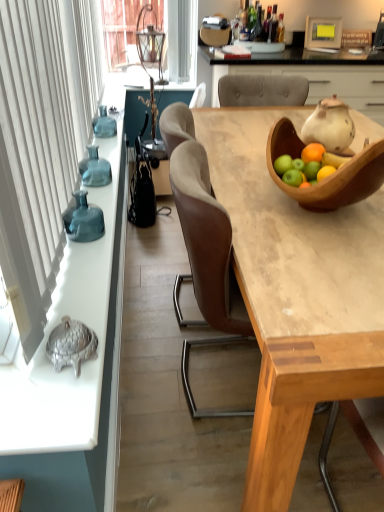
Question: Considering the relative positions of translucent glass vase at left, the 2th vase from the bottom, and wooden bowl at upper right in the image provided, is translucent glass vase at left, the 2th vase from the bottom, to the left or to the right of wooden bowl at upper right?

Choices:
 (A) left
 (B) right

Answer: (A)

Question: Is translucent glass vase at left, which is the 1th vase from top to bottom, situated inside wooden bowl at upper right or outside?

Choices:
 (A) inside
 (B) outside

Answer: (B)

Question: Which object is the closest to the translucent glass vase at left?

Choices:
 (A) teal glass vase at left, which is counted as the second vase, starting from the back
 (B) wooden table at center
 (C) wooden cabinet at upper center
 (D) metallic silver turtle at left
 (E) translucent glass vase at left, the second vase positioned from the front

Answer: (E)

Question: Considering the real-world distances, which object is closest to the metallic silver turtle at left?

Choices:
 (A) translucent glass vase at left, the 2th vase from the bottom
 (B) translucent glass vase at left
 (C) wooden cabinet at upper center
 (D) wooden bowl at upper right
 (E) teal glass vase at left, placed as the second vase when sorted from top to bottom

Answer: (E)